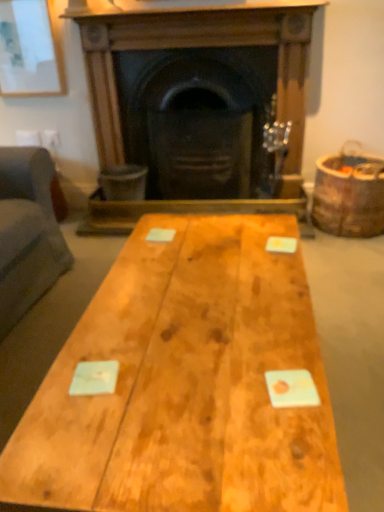
Identify the location of wooden fireplace at center. (200, 106).

Describe the element at coordinates (29, 50) in the screenshot. This screenshot has width=384, height=512. I see `matte white picture frame at upper left` at that location.

Where is `wooden fireplace at center`? This screenshot has width=384, height=512. wooden fireplace at center is located at coordinates (200, 106).

Considering the positions of objects natural wood table at center and brown wooden barrel at right in the image provided, who is more to the left, natural wood table at center or brown wooden barrel at right?

natural wood table at center is more to the left.

From the image's perspective, does natural wood table at center appear higher than brown wooden barrel at right?

No, from the image's perspective, natural wood table at center is not above brown wooden barrel at right.

From their relative heights in the image, would you say natural wood table at center is taller or shorter than brown wooden barrel at right?

Considering their sizes, natural wood table at center has less height than brown wooden barrel at right.

From a real-world perspective, is brown wooden barrel at right located higher than wooden fireplace at center?

No, from a real-world perspective, brown wooden barrel at right is not above wooden fireplace at center.

Is brown wooden barrel at right not within wooden fireplace at center?

Indeed, brown wooden barrel at right is completely outside wooden fireplace at center.

Does brown wooden barrel at right come behind wooden fireplace at center?

No.

From the image's perspective, does brown wooden barrel at right appear lower than wooden fireplace at center?

Yes.

From the image's perspective, which one is positioned higher, wooden fireplace at center or natural wood table at center?

wooden fireplace at center is shown above in the image.

Are wooden fireplace at center and natural wood table at center far apart?

Yes, wooden fireplace at center and natural wood table at center are quite far apart.

Which object is thinner, wooden fireplace at center or natural wood table at center?

With smaller width is wooden fireplace at center.

Does point (305, 58) come behind point (124, 401)?

Yes, point (305, 58) is farther from viewer.

How different are the orientations of matte white picture frame at upper left and wooden fireplace at center in degrees?

0.0136 degrees.

Between matte white picture frame at upper left and wooden fireplace at center, which one has smaller size?

matte white picture frame at upper left.

How distant is matte white picture frame at upper left from wooden fireplace at center?

A distance of 26.15 inches exists between matte white picture frame at upper left and wooden fireplace at center.

From a real-world perspective, does matte white picture frame at upper left stand above wooden fireplace at center?

Correct, in the physical world, matte white picture frame at upper left is higher than wooden fireplace at center.

The image size is (384, 512). I want to click on barrel located on the right of matte white picture frame at upper left, so click(x=349, y=195).

Is brown wooden barrel at right shorter than matte white picture frame at upper left?

Indeed, brown wooden barrel at right has a lesser height compared to matte white picture frame at upper left.

From a real-world perspective, who is located lower, brown wooden barrel at right or matte white picture frame at upper left?

brown wooden barrel at right, from a real-world perspective.

Between brown wooden barrel at right and matte white picture frame at upper left, which one appears on the left side from the viewer's perspective?

From the viewer's perspective, matte white picture frame at upper left appears more on the left side.

Is matte white picture frame at upper left next to brown wooden barrel at right and touching it?

No, matte white picture frame at upper left is not in contact with brown wooden barrel at right.

Which is closer to the camera, (x=19, y=53) or (x=315, y=221)?

Point (x=19, y=53) is positioned farther from the camera compared to point (x=315, y=221).

Based on the photo, is matte white picture frame at upper left spatially inside brown wooden barrel at right, or outside of it?

matte white picture frame at upper left is outside brown wooden barrel at right.

Is matte white picture frame at upper left bigger than brown wooden barrel at right?

No, matte white picture frame at upper left is not bigger than brown wooden barrel at right.

Is wooden fireplace at center oriented away from brown wooden barrel at right?

That's not correct — wooden fireplace at center is not looking away from brown wooden barrel at right.

Considering the sizes of wooden fireplace at center and brown wooden barrel at right in the image, is wooden fireplace at center bigger or smaller than brown wooden barrel at right?

Considering their sizes, wooden fireplace at center takes up more space than brown wooden barrel at right.

Measure the distance between wooden fireplace at center and brown wooden barrel at right.

wooden fireplace at center is 22.88 inches from brown wooden barrel at right.

In the scene shown: Based on their positions, is wooden fireplace at center located to the left or right of brown wooden barrel at right?

wooden fireplace at center is positioned on brown wooden barrel at right's left side.

Where is `barrel behind the natural wood table at center`? The image size is (384, 512). barrel behind the natural wood table at center is located at coordinates (349, 195).

At what (x,y) coordinates should I click in order to perform the action: click on fireplace on the left of brown wooden barrel at right. Please return your answer as a coordinate pair (x, y). Image resolution: width=384 pixels, height=512 pixels. Looking at the image, I should click on (200, 106).

When comparing their distances from brown wooden barrel at right, does natural wood table at center or matte white picture frame at upper left seem closer?

natural wood table at center lies closer to brown wooden barrel at right than the other object.

Estimate the real-world distances between objects in this image. Which object is further from natural wood table at center, brown wooden barrel at right or wooden fireplace at center?

wooden fireplace at center is positioned further to the anchor natural wood table at center.

Considering their positions, is brown wooden barrel at right positioned further to natural wood table at center than matte white picture frame at upper left?

matte white picture frame at upper left is further to natural wood table at center.

Estimate the real-world distances between objects in this image. Which object is closer to matte white picture frame at upper left, natural wood table at center or brown wooden barrel at right?

Among the two, brown wooden barrel at right is located nearer to matte white picture frame at upper left.

From the image, which object appears to be nearer to natural wood table at center, matte white picture frame at upper left or brown wooden barrel at right?

brown wooden barrel at right is positioned closer to the anchor natural wood table at center.

When comparing their distances from wooden fireplace at center, does matte white picture frame at upper left or natural wood table at center seem further?

The object further to wooden fireplace at center is natural wood table at center.

Based on their spatial positions, is natural wood table at center or brown wooden barrel at right further from wooden fireplace at center?

natural wood table at center.

Considering their positions, is matte white picture frame at upper left positioned further to wooden fireplace at center than brown wooden barrel at right?

matte white picture frame at upper left is further to wooden fireplace at center.

In order to click on fireplace between matte white picture frame at upper left and brown wooden barrel at right in the horizontal direction in this screenshot , I will do `click(200, 106)`.

The image size is (384, 512). Identify the location of barrel located between natural wood table at center and wooden fireplace at center in the depth direction. pyautogui.click(x=349, y=195).

This screenshot has height=512, width=384. I want to click on fireplace between natural wood table at center and matte white picture frame at upper left from front to back, so click(x=200, y=106).

Locate an element on the screen. table situated between matte white picture frame at upper left and brown wooden barrel at right from left to right is located at coordinates (186, 384).